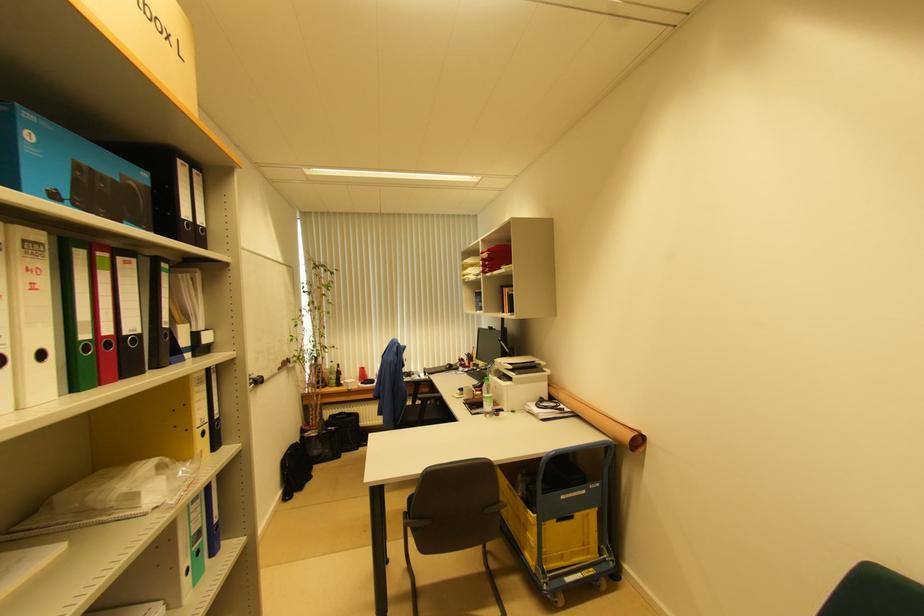
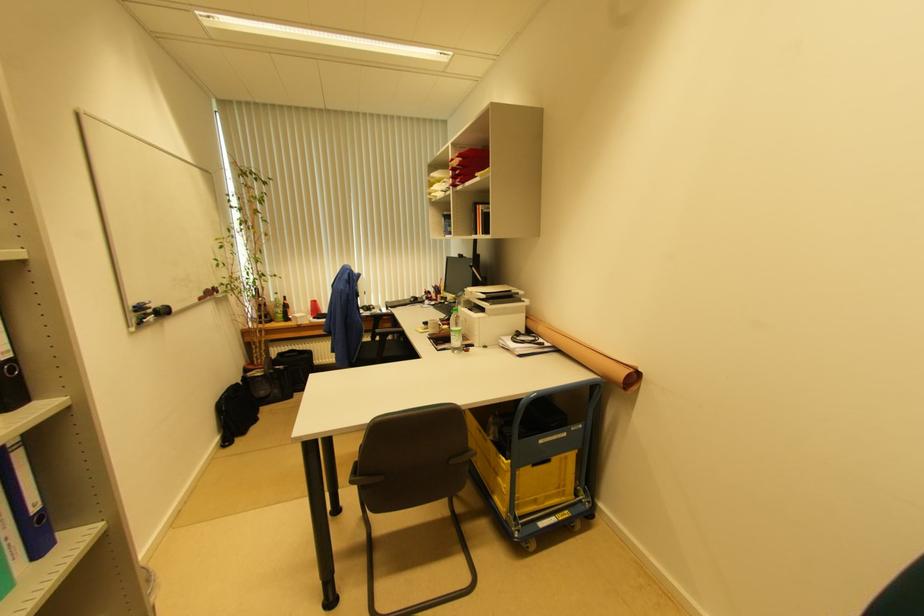
In the second image, find the point that corresponds to [301,442] in the first image.

(242, 383)